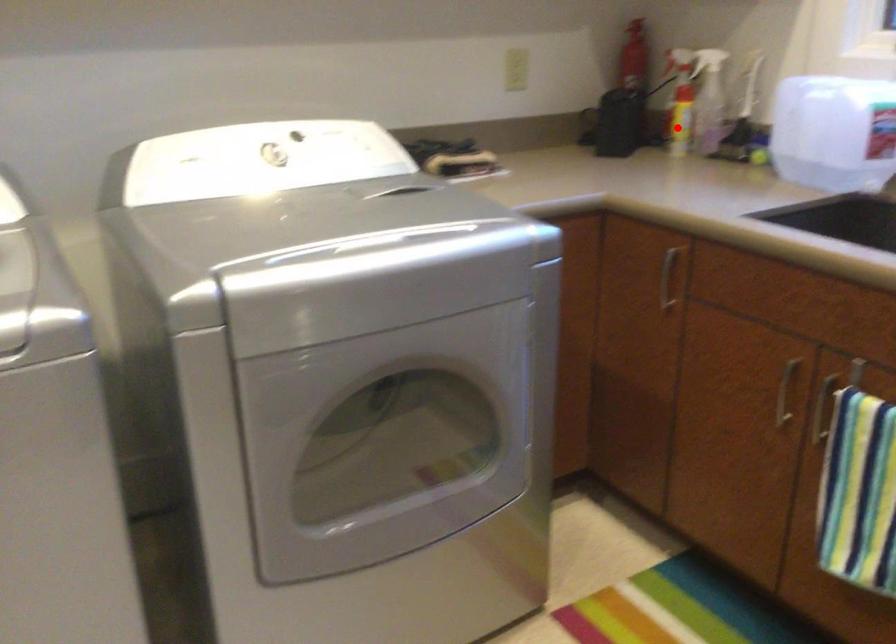
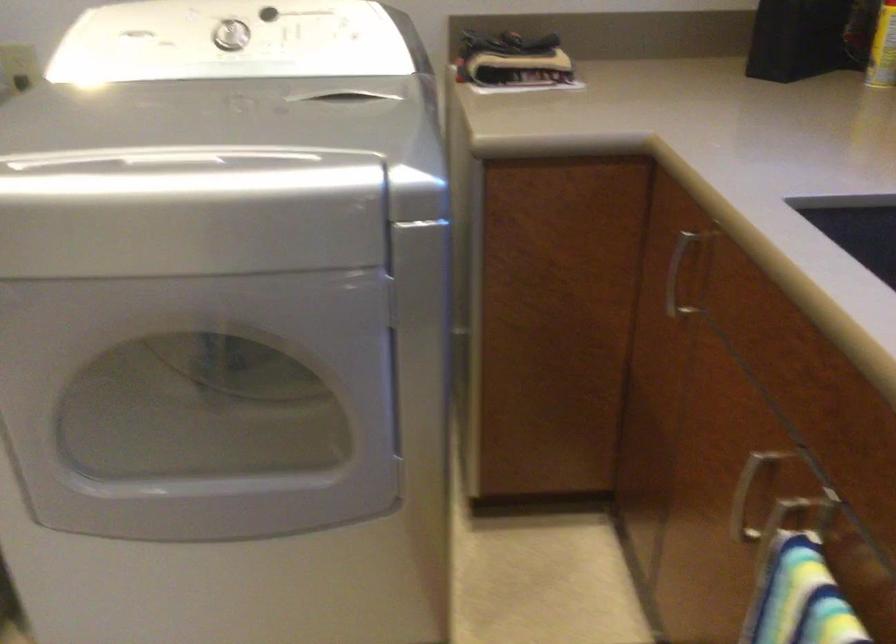
Where in the second image is the point corresponding to the highlighted location from the first image?

(883, 49)